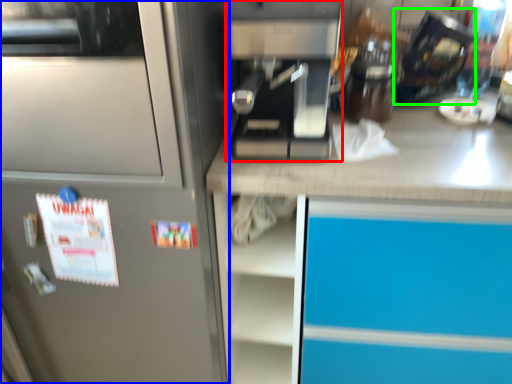
Question: Estimate the real-world distances between objects in this image. Which object is farther from kitchen appliance (highlighted by a red box), home appliance (highlighted by a blue box) or appliance (highlighted by a green box)?

Choices:
 (A) home appliance
 (B) appliance

Answer: (B)